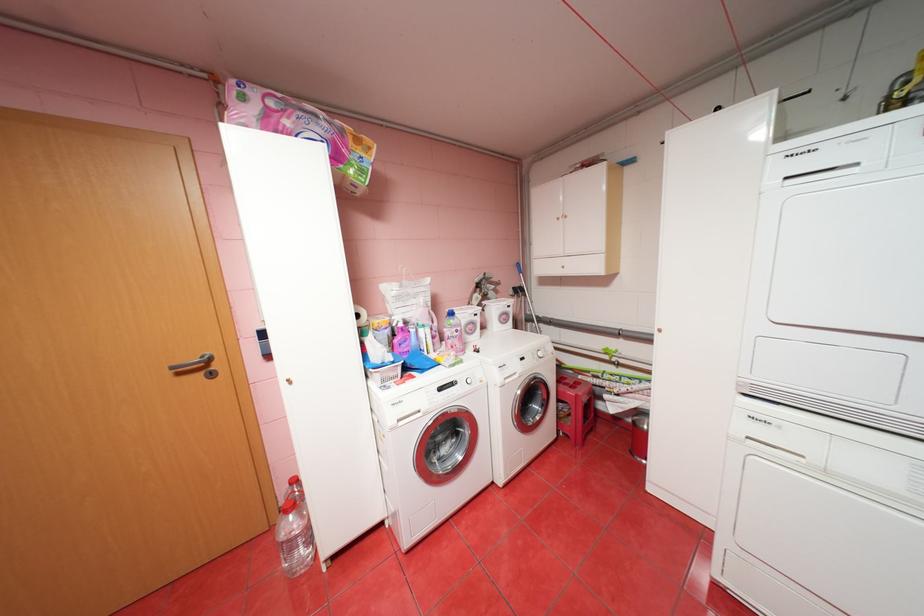
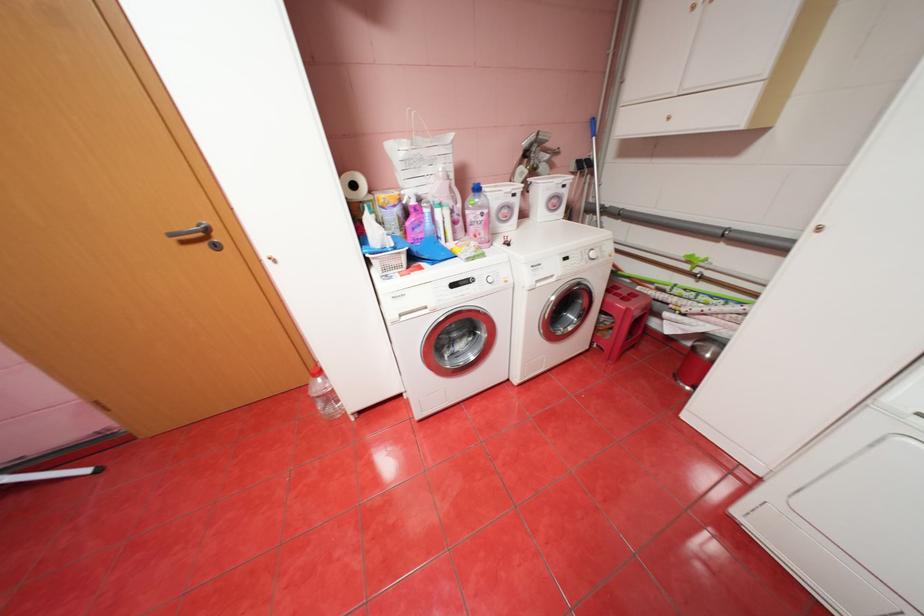
Where in the second image is the point corresponding to pixel 209 374 from the first image?

(213, 245)